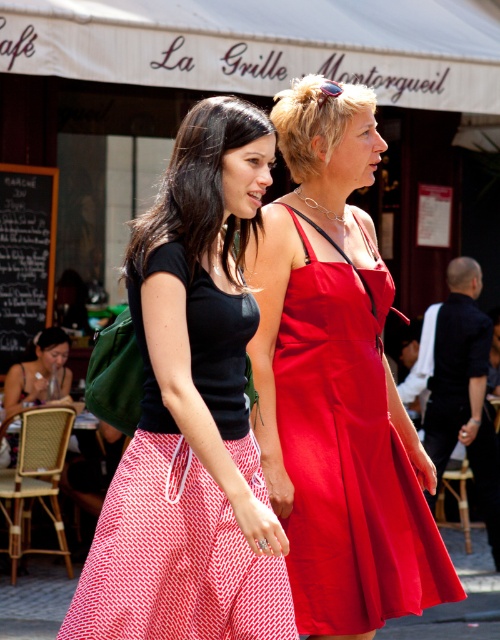
Question: Which of the following is the closest to the observer?

Choices:
 (A) matte black top at center
 (B) shiny satin dress at center

Answer: (A)

Question: Can you confirm if matte black top at center is thinner than shiny satin dress at center?

Choices:
 (A) no
 (B) yes

Answer: (A)

Question: Is matte black top at center closer to the viewer compared to shiny satin dress at center?

Choices:
 (A) yes
 (B) no

Answer: (A)

Question: Is matte black top at center to the left of shiny satin dress at center from the viewer's perspective?

Choices:
 (A) no
 (B) yes

Answer: (B)